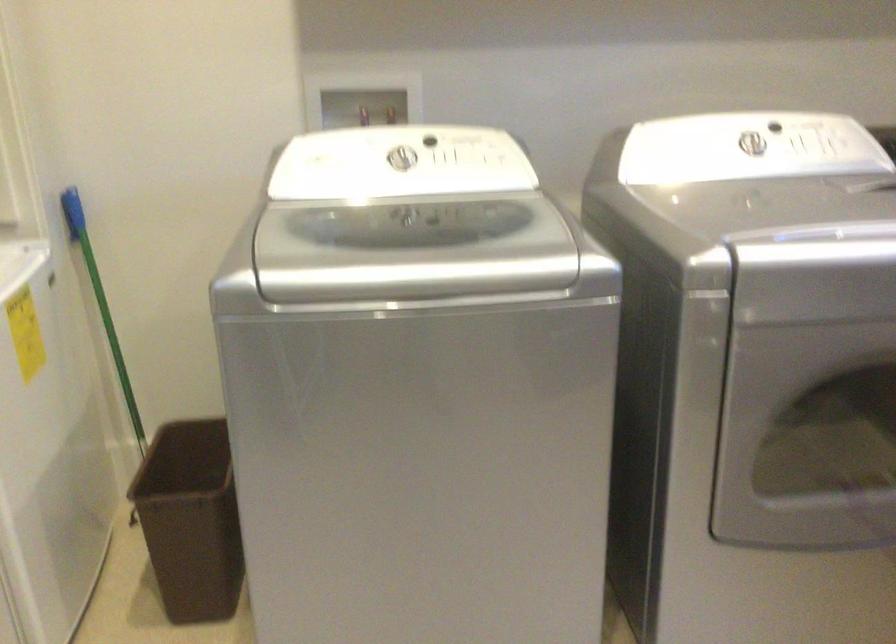
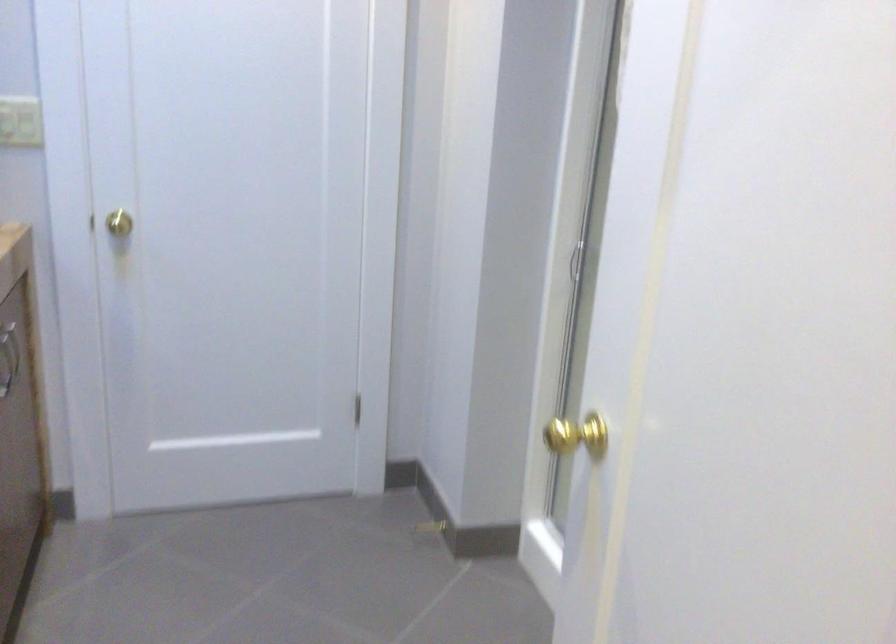
Question: The camera is either moving clockwise (left) or counter-clockwise (right) around the object. The first image is from the beginning of the video and the second image is from the end. Is the camera moving left or right when shooting the video?

Choices:
 (A) Left
 (B) Right

Answer: (B)